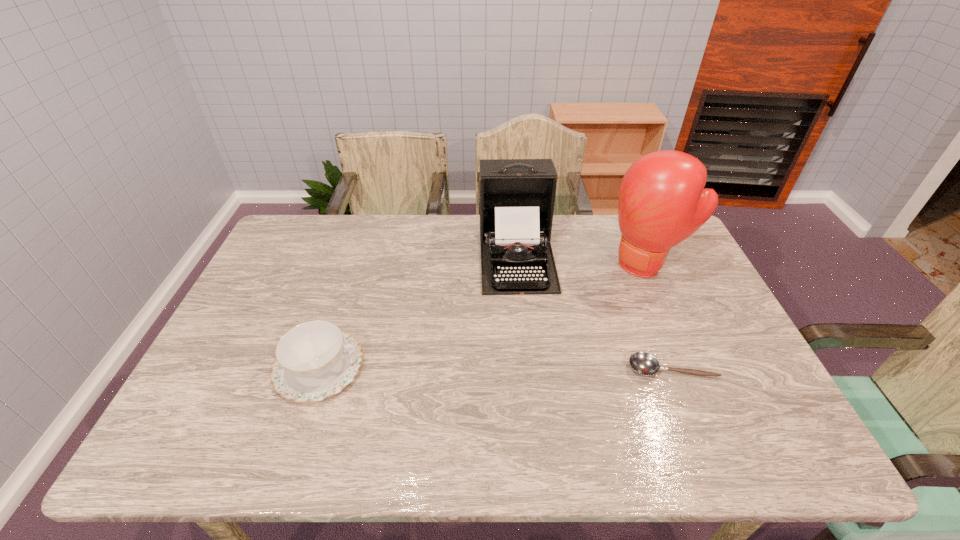
The width and height of the screenshot is (960, 540). I want to click on vacant space on the desktop that is between the leftmost object and the ladle and is positioned inside the open case of the typewriter, so click(532, 368).

Where is `vacant space on the desktop that is between the chinaware and the shortest object and is positioned on the striking surface of the boxing glove`? This screenshot has width=960, height=540. vacant space on the desktop that is between the chinaware and the shortest object and is positioned on the striking surface of the boxing glove is located at coordinates (520, 368).